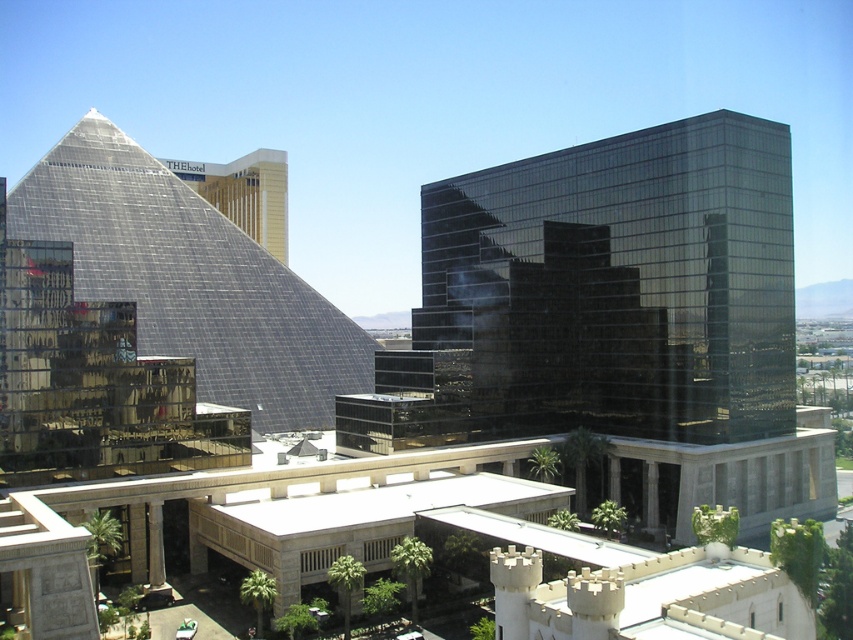
You are standing in front of the modern architectural complex and want to determine the relative positions of two points marked in the image. Which point, point 1 at coordinates (73, 237) or point 2 at coordinates (265, 182), is closer to you?

Point 1 at coordinates (73, 237) is closer to the viewer than point 2 at coordinates (265, 182).

You are standing at point (624, 280) in the urban landscape. What can you see directly in front of you?

At point (624, 280) lies shiny glass building at center.